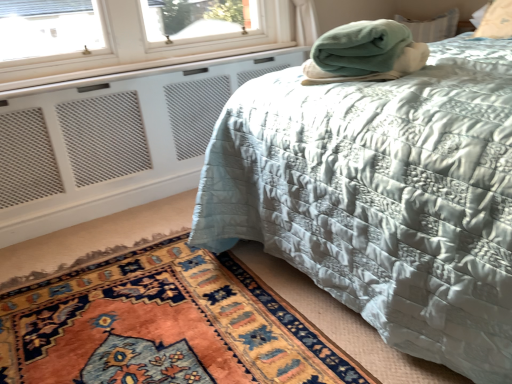
This screenshot has width=512, height=384. What are the coordinates of `empty space that is ontop of white mesh radiator at lower left (from a real-world perspective)` in the screenshot? It's located at (139, 68).